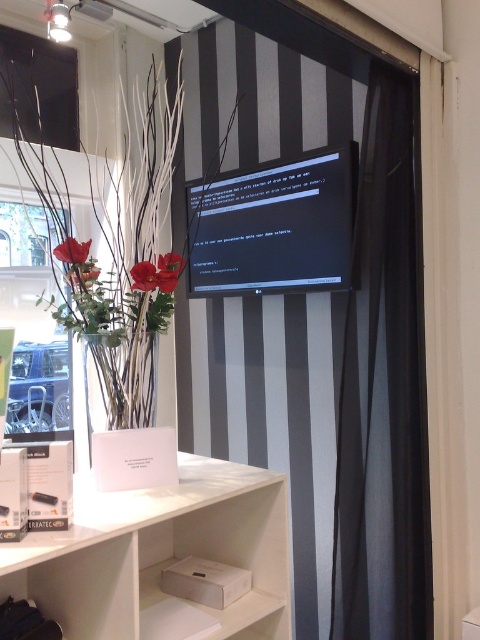
Question: Where is matte red flower at center located in relation to matte black flower at upper left in the image?

Choices:
 (A) above
 (B) below

Answer: (A)

Question: Which point is farther to the camera?

Choices:
 (A) (x=68, y=241)
 (B) (x=97, y=412)
 (C) (x=171, y=268)
 (D) (x=73, y=269)

Answer: (B)

Question: Is black sheer curtain at right smaller than red matte flower at center?

Choices:
 (A) yes
 (B) no

Answer: (B)

Question: Which point is closer to the camera taking this photo?

Choices:
 (A) (397, 385)
 (B) (68, 256)

Answer: (B)

Question: Which of the following is the closest to the observer?

Choices:
 (A) (169, 260)
 (B) (76, 264)
 (C) (218, 269)

Answer: (B)

Question: Is black sheer curtain at right wider than black glossy monitor at upper center?

Choices:
 (A) yes
 (B) no

Answer: (B)